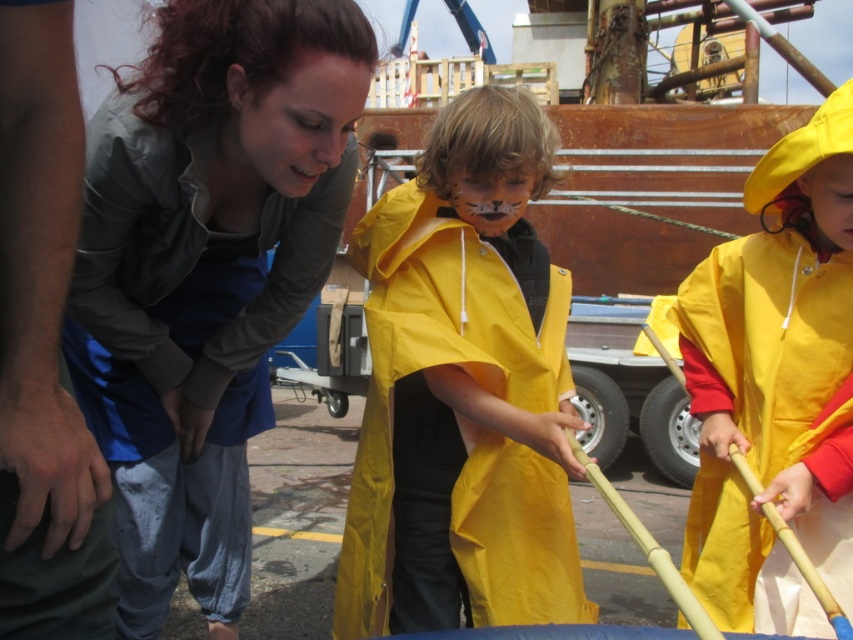
Question: Estimate the real-world distances between objects in this image. Which object is farther from the matte gray jacket at upper left?

Choices:
 (A) yellow matte raincoat at right
 (B) matte yellow raincoat at center

Answer: (A)

Question: Estimate the real-world distances between objects in this image. Which object is farther from the matte gray jacket at upper left?

Choices:
 (A) matte yellow raincoat at center
 (B) yellow matte raincoat at right

Answer: (B)

Question: Is matte gray jacket at upper left positioned in front of yellow matte raincoat at right?

Choices:
 (A) yes
 (B) no

Answer: (A)

Question: Considering the relative positions of matte yellow raincoat at center and yellow matte raincoat at right in the image provided, where is matte yellow raincoat at center located with respect to yellow matte raincoat at right?

Choices:
 (A) above
 (B) below

Answer: (B)

Question: Considering the real-world distances, which object is closest to the yellow matte raincoat at right?

Choices:
 (A) matte gray jacket at upper left
 (B) matte yellow raincoat at center

Answer: (B)

Question: Can you confirm if matte gray jacket at upper left is bigger than matte yellow raincoat at center?

Choices:
 (A) yes
 (B) no

Answer: (A)